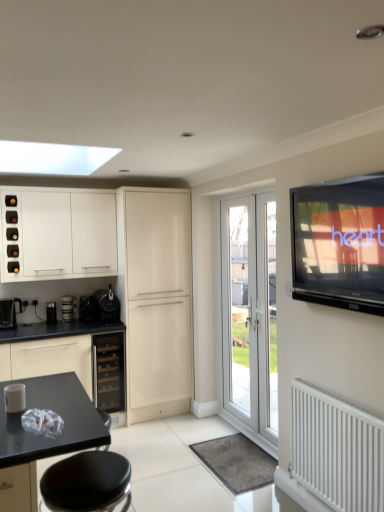
Question: Should I look upward or downward to see black plastic coffee machine at left?

Choices:
 (A) up
 (B) down

Answer: (B)

Question: Is black leather bar stool at lower left touching glossy cream cabinet at center, placed as the 1th cabinetry when sorted from right to left?

Choices:
 (A) yes
 (B) no

Answer: (B)

Question: From the image's perspective, is black leather bar stool at lower left above glossy cream cabinet at center, placed as the 1th cabinetry when sorted from right to left?

Choices:
 (A) yes
 (B) no

Answer: (B)

Question: From the image's perspective, does black leather bar stool at lower left appear lower than glossy cream cabinet at center, which appears as the 2th cabinetry when viewed from the left?

Choices:
 (A) yes
 (B) no

Answer: (A)

Question: Are black leather bar stool at lower left and glossy cream cabinet at center, which appears as the 2th cabinetry when viewed from the left, located far from each other?

Choices:
 (A) yes
 (B) no

Answer: (A)

Question: Does black leather bar stool at lower left have a lesser height compared to glossy cream cabinet at center, which appears as the 2th cabinetry when viewed from the left?

Choices:
 (A) no
 (B) yes

Answer: (B)

Question: Considering the relative sizes of black leather bar stool at lower left and glossy cream cabinet at center, placed as the 1th cabinetry when sorted from right to left, in the image provided, is black leather bar stool at lower left thinner than glossy cream cabinet at center, placed as the 1th cabinetry when sorted from right to left,?

Choices:
 (A) no
 (B) yes

Answer: (B)

Question: Is flat-screen tv at upper right taller than satin black coffee machine at lower center, the 4th appliance from the left?

Choices:
 (A) yes
 (B) no

Answer: (A)

Question: Considering the relative sizes of flat-screen tv at upper right and satin black coffee machine at lower center, positioned as the first appliance in right-to-left order, in the image provided, is flat-screen tv at upper right thinner than satin black coffee machine at lower center, positioned as the first appliance in right-to-left order,?

Choices:
 (A) no
 (B) yes

Answer: (B)

Question: Is flat-screen tv at upper right looking in the opposite direction of satin black coffee machine at lower center, positioned as the first appliance in right-to-left order?

Choices:
 (A) no
 (B) yes

Answer: (A)

Question: Considering the relative positions of flat-screen tv at upper right and satin black coffee machine at lower center, positioned as the first appliance in right-to-left order, in the image provided, is flat-screen tv at upper right to the left of satin black coffee machine at lower center, positioned as the first appliance in right-to-left order, from the viewer's perspective?

Choices:
 (A) no
 (B) yes

Answer: (A)

Question: Is flat-screen tv at upper right directly adjacent to satin black coffee machine at lower center, positioned as the first appliance in right-to-left order?

Choices:
 (A) yes
 (B) no

Answer: (B)

Question: Is the depth of flat-screen tv at upper right greater than that of satin black coffee machine at lower center, the 4th appliance from the left?

Choices:
 (A) yes
 (B) no

Answer: (B)

Question: Considering the relative sizes of white glossy cabinet at upper left, placed as the 1th cabinetry when sorted from left to right, and metallic silver cup at left, marked as the 2th appliance in a left-to-right arrangement, in the image provided, is white glossy cabinet at upper left, placed as the 1th cabinetry when sorted from left to right, shorter than metallic silver cup at left, marked as the 2th appliance in a left-to-right arrangement,?

Choices:
 (A) yes
 (B) no

Answer: (B)